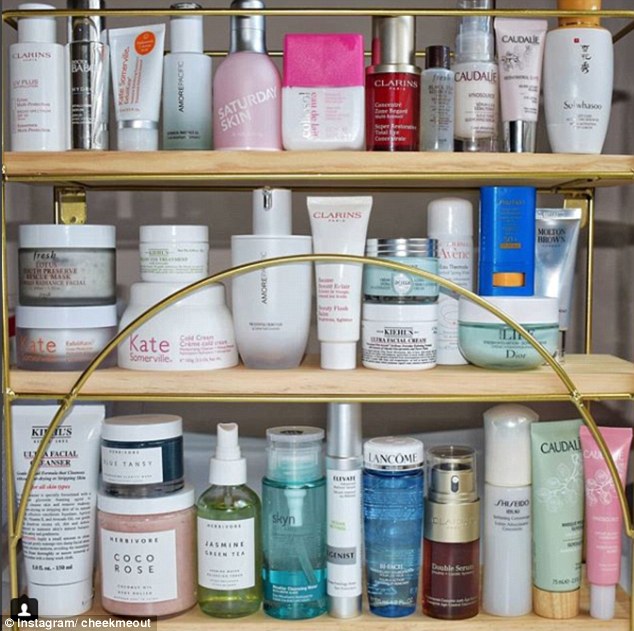
Identify the location of white background behind bottom shelf. This screenshot has width=634, height=631. (198, 464), (254, 462), (474, 437).